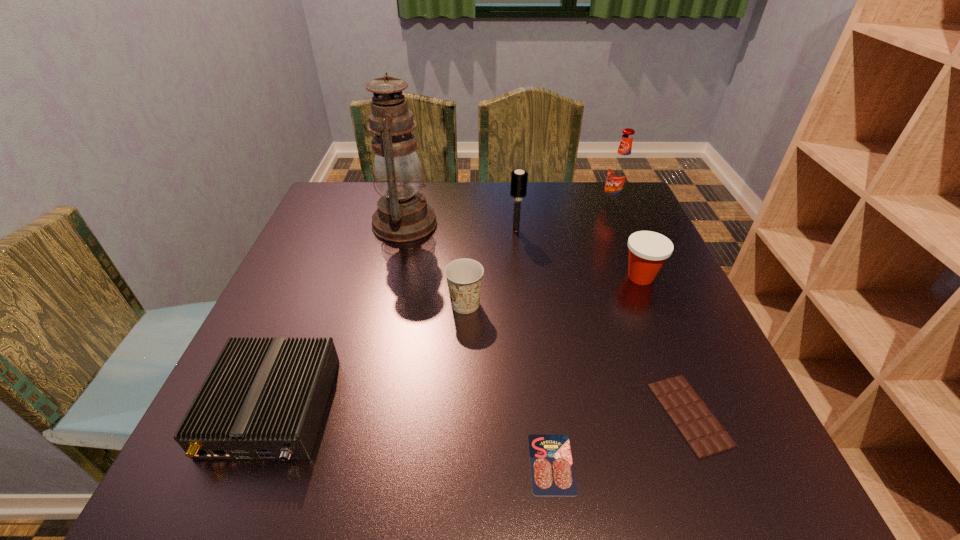
What are the coordinates of `free location that satisfies the following two spatial constraints: 1. on the front side of the oil lamp; 2. on the right side of the farther Dixie cup` in the screenshot? It's located at (393, 277).

Identify the location of vacant region that satisfies the following two spatial constraints: 1. on the back panel of the router; 2. on the right side of the second shortest object. The width and height of the screenshot is (960, 540). (270, 414).

Find the location of a particular element. This screenshot has height=540, width=960. vacant region that satisfies the following two spatial constraints: 1. on the front side of the fifth nearest object; 2. on the left side of the tallest object is located at coordinates (393, 277).